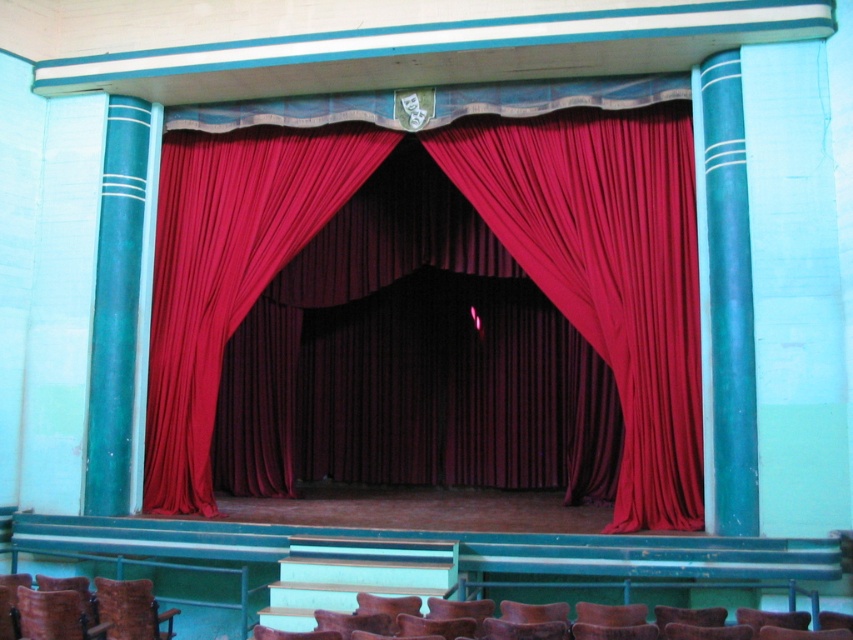
You are an actor preparing to enter the stage and see the velvet red curtain at center and the velvet brown chair at lower left. Which object is closer to you as you stand at the entrance?

The velvet red curtain at center is closer to you because it is further to the viewer than the velvet brown chair at lower left, meaning it occupies a more forward position in the stage area.

You are standing on the stage and see a point marked at coordinates (x=607, y=269). According to the scene description, where exactly is this point located?

The point at coordinates (x=607, y=269) is on the velvet red curtain at center.